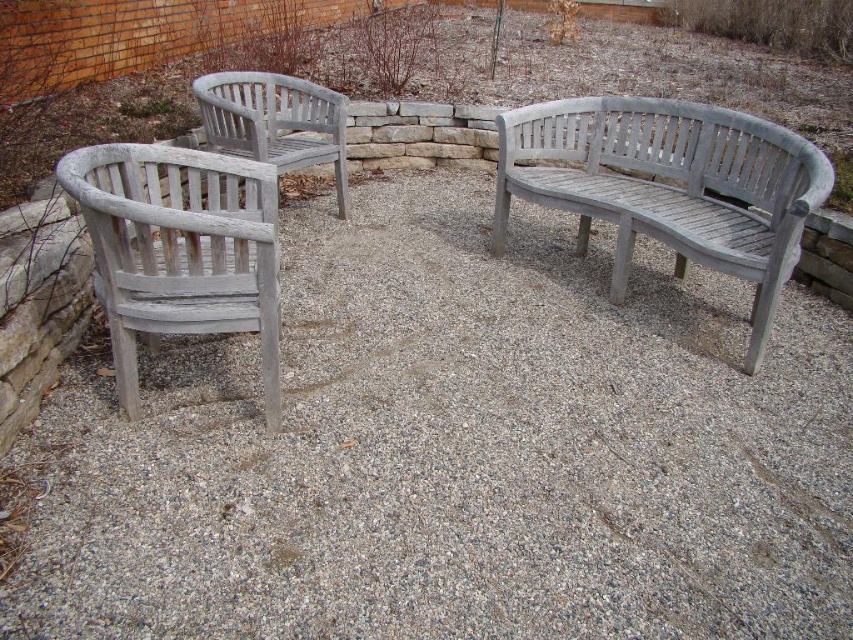
Question: From the image, what is the correct spatial relationship of gray gravel at center in relation to gray wood bench at center?

Choices:
 (A) left
 (B) right

Answer: (B)

Question: Does gray gravel at center appear over gray wood bench at center?

Choices:
 (A) no
 (B) yes

Answer: (A)

Question: Does gray gravel at center have a larger size compared to weathered wood bench at right?

Choices:
 (A) no
 (B) yes

Answer: (B)

Question: Which object is the closest to the gray gravel at center?

Choices:
 (A) white weathered wood chair at left
 (B) weathered wood bench at right
 (C) gray wood bench at center

Answer: (B)

Question: Among these objects, which one is farthest from the camera?

Choices:
 (A) weathered wood bench at right
 (B) white weathered wood chair at left

Answer: (A)

Question: Which object is closer to the camera taking this photo?

Choices:
 (A) white weathered wood chair at left
 (B) gray gravel at center
 (C) weathered wood bench at right
 (D) gray wood bench at center

Answer: (B)